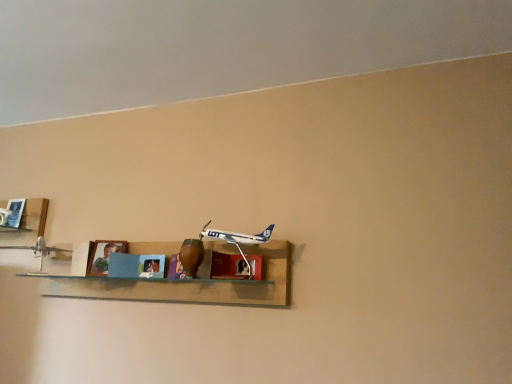
Question: Does wooden shelf at left, the 1th shelf when ordered from left to right, appear on the left side of wooden shelf at center, the first shelf viewed from the right?

Choices:
 (A) no
 (B) yes

Answer: (B)

Question: Is wooden shelf at center, the second shelf viewed from the left, located within wooden shelf at left, the 1th shelf when ordered from left to right?

Choices:
 (A) yes
 (B) no

Answer: (B)

Question: Considering the relative sizes of wooden shelf at left, the 1th shelf when ordered from left to right, and wooden shelf at center, the first shelf viewed from the right, in the image provided, is wooden shelf at left, the 1th shelf when ordered from left to right, thinner than wooden shelf at center, the first shelf viewed from the right,?

Choices:
 (A) yes
 (B) no

Answer: (A)

Question: Considering the relative sizes of wooden shelf at left, the 1th shelf when ordered from left to right, and wooden shelf at center, the first shelf viewed from the right, in the image provided, is wooden shelf at left, the 1th shelf when ordered from left to right, shorter than wooden shelf at center, the first shelf viewed from the right,?

Choices:
 (A) no
 (B) yes

Answer: (B)

Question: Does wooden shelf at left, the 2th shelf when ordered from right to left, have a smaller size compared to wooden shelf at center, the second shelf viewed from the left?

Choices:
 (A) yes
 (B) no

Answer: (A)

Question: Does wooden shelf at left, the 1th shelf when ordered from left to right, lie in front of wooden shelf at center, the second shelf viewed from the left?

Choices:
 (A) no
 (B) yes

Answer: (A)

Question: Can you confirm if wooden shelf at left, the 2th shelf when ordered from right to left, is wider than metallic silver airplane at left, which is the 2th toy from right to left?

Choices:
 (A) no
 (B) yes

Answer: (A)

Question: Can metallic silver airplane at left, arranged as the 1th toy when viewed from the left, be found inside wooden shelf at left, the 2th shelf when ordered from right to left?

Choices:
 (A) no
 (B) yes

Answer: (A)

Question: Is wooden shelf at left, the 2th shelf when ordered from right to left, positioned before metallic silver airplane at left, the 1th toy positioned from the back?

Choices:
 (A) yes
 (B) no

Answer: (B)

Question: Are wooden shelf at left, the 1th shelf when ordered from left to right, and metallic silver airplane at left, which is the 2th toy from right to left, far apart?

Choices:
 (A) yes
 (B) no

Answer: (B)

Question: From a real-world perspective, is wooden shelf at left, the 1th shelf when ordered from left to right, on metallic silver airplane at left, which is the 2th toy in front-to-back order?

Choices:
 (A) no
 (B) yes

Answer: (B)

Question: Considering the relative sizes of wooden shelf at left, the 1th shelf when ordered from left to right, and metallic silver airplane at left, the 1th toy positioned from the back, in the image provided, is wooden shelf at left, the 1th shelf when ordered from left to right, shorter than metallic silver airplane at left, the 1th toy positioned from the back,?

Choices:
 (A) yes
 (B) no

Answer: (A)

Question: Is wooden shelf at center, the second shelf viewed from the left, smaller than white plastic airplane at center, the second toy when ordered from left to right?

Choices:
 (A) yes
 (B) no

Answer: (B)